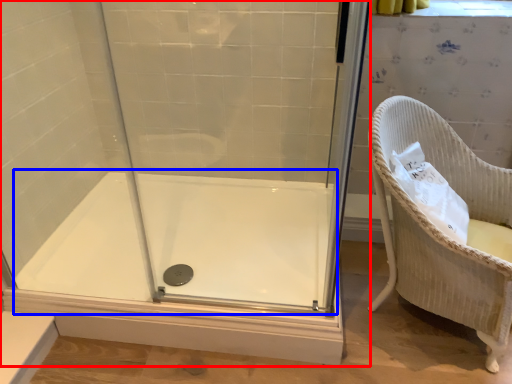
Question: Which object appears farthest to the camera in this image, shower door (highlighted by a red box) or bath (highlighted by a blue box)?

Choices:
 (A) shower door
 (B) bath

Answer: (B)